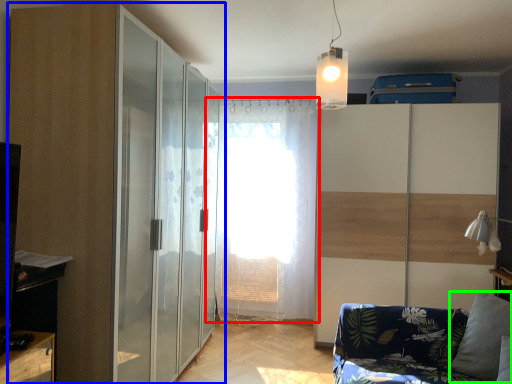
Question: Which object is the farthest from curtain (highlighted by a red box)? Choose among these: door (highlighted by a blue box) or pillow (highlighted by a green box).

Choices:
 (A) door
 (B) pillow

Answer: (B)